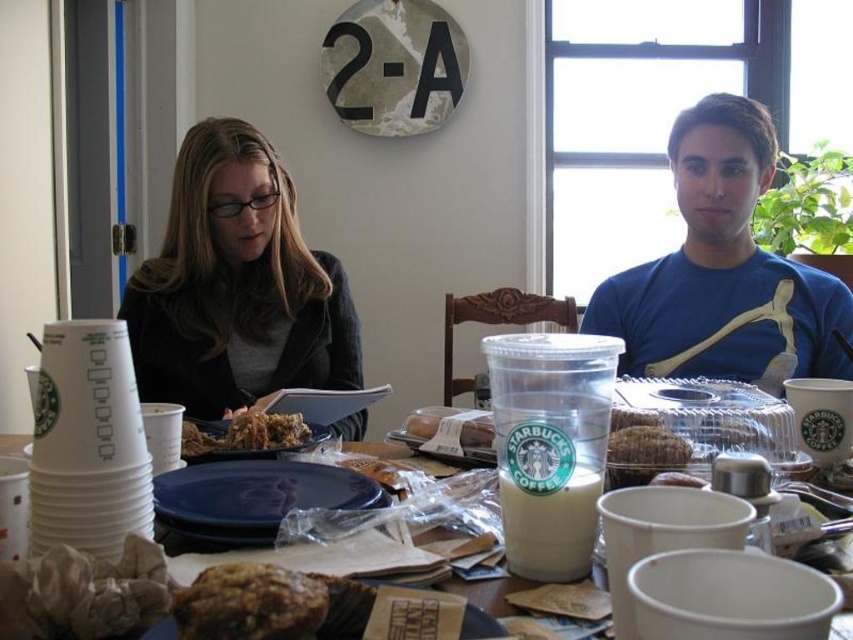
You are a chef trying to stack ingredients for a dish. You have the matte brown bread at center and the smooth white pastry at center. Which one should you choose as the base to ensure stability?

The matte brown bread at center has a greater height compared to the smooth white pastry at center, so it would provide a more stable base for stacking ingredients.

You are planning to place a new item on the table between the matte black jacket at left and the white opaque cup at center. Which object should you move to make space, and why?

You should move the white opaque cup at center because the matte black jacket at left is bigger and might be harder to move.

You are taking a photo of the brown crumbly pastry at center. The camera is 17.94 inches away from it. If the camera requires a minimum distance of 18 inches to focus properly, will the photo be in focus?

The brown crumbly pastry at center and camera are 17.94 inches apart, which is less than the required 18 inches. Therefore, the photo may not be in focus.